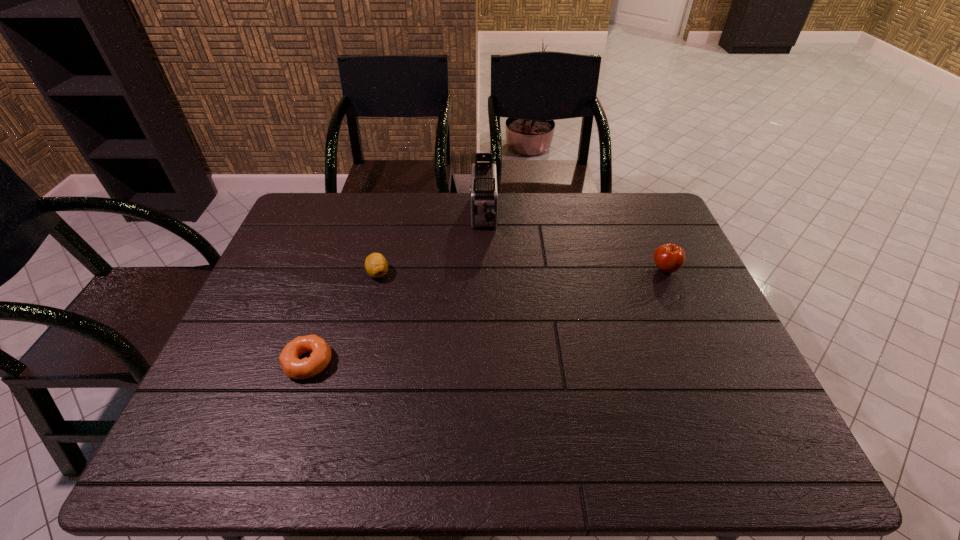
Image resolution: width=960 pixels, height=540 pixels. What are the coordinates of `vacant space located 0.360m at the stem end of the lemon` in the screenshot? It's located at (348, 395).

In order to click on vacant space situated on the front of the doughnut in this screenshot , I will do `click(274, 465)`.

Locate an element on the screen. object located in the far edge section of the desktop is located at coordinates (483, 191).

The image size is (960, 540). I want to click on object that is at the left edge, so click(x=320, y=356).

Where is `object that is at the right edge`? This screenshot has width=960, height=540. object that is at the right edge is located at coordinates (669, 258).

Identify the location of vacant space at the far edge of the desktop. (588, 225).

The height and width of the screenshot is (540, 960). What are the coordinates of `vacant area at the near edge of the desktop` in the screenshot? It's located at point(588,430).

Locate an element on the screen. vacant space at the left edge of the desktop is located at coordinates (272, 347).

Find the location of a particular element. vacant space at the right edge is located at coordinates (722, 374).

Locate an element on the screen. blank space at the far left corner of the desktop is located at coordinates (327, 234).